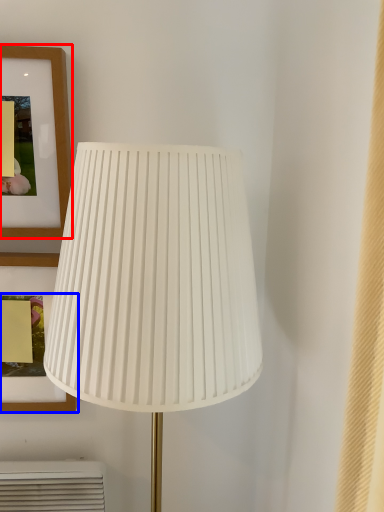
Question: Which object appears closest to the camera in this image, picture frame (highlighted by a red box) or picture frame (highlighted by a blue box)?

Choices:
 (A) picture frame
 (B) picture frame

Answer: (A)